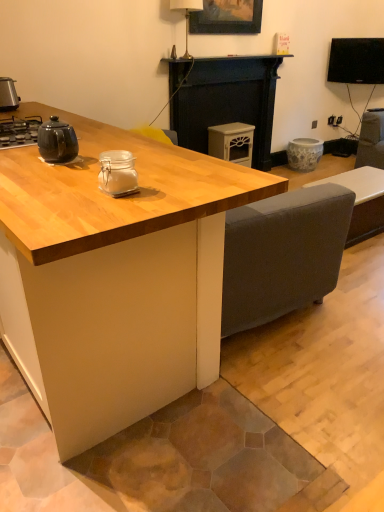
Question: Does porcelain floral pot at center, positioned as the 4th appliance in front-to-back order, have a greater width compared to clear glass jar at center, which appears as the third appliance when viewed from the right?

Choices:
 (A) no
 (B) yes

Answer: (B)

Question: Is porcelain floral pot at center, positioned as the 4th appliance in front-to-back order, oriented away from clear glass jar at center, which is counted as the 4th appliance, starting from the back?

Choices:
 (A) no
 (B) yes

Answer: (A)

Question: Can you confirm if porcelain floral pot at center, arranged as the 1th appliance when viewed from the back, is positioned to the left of clear glass jar at center, which is the first appliance in front-to-back order?

Choices:
 (A) no
 (B) yes

Answer: (A)

Question: From a real-world perspective, is porcelain floral pot at center, which ranks as the 4th appliance in left-to-right order, on clear glass jar at center, which ranks as the 2th appliance in left-to-right order?

Choices:
 (A) no
 (B) yes

Answer: (A)

Question: Does porcelain floral pot at center, positioned as the 4th appliance in front-to-back order, have a lesser height compared to clear glass jar at center, which appears as the third appliance when viewed from the right?

Choices:
 (A) no
 (B) yes

Answer: (A)

Question: From a real-world perspective, relative to light wood table at center, is matte cream cabinet at center, marked as the third appliance in a left-to-right arrangement, vertically above or below?

Choices:
 (A) below
 (B) above

Answer: (A)

Question: Looking at their shapes, would you say matte cream cabinet at center, the 3th appliance from the front, is wider or thinner than light wood table at center?

Choices:
 (A) wide
 (B) thin

Answer: (B)

Question: From the image's perspective, is matte cream cabinet at center, the 2th appliance viewed from the right, above or below light wood table at center?

Choices:
 (A) below
 (B) above

Answer: (B)

Question: Looking at the image, does matte cream cabinet at center, the 3th appliance from the front, seem bigger or smaller compared to light wood table at center?

Choices:
 (A) big
 (B) small

Answer: (B)

Question: Based on their sizes in the image, would you say metallic silver toaster at left, marked as the 3th appliance in a back-to-front arrangement, is bigger or smaller than wooden picture frame at upper center?

Choices:
 (A) big
 (B) small

Answer: (B)

Question: In the image, is metallic silver toaster at left, positioned as the first appliance in left-to-right order, positioned in front of or behind wooden picture frame at upper center?

Choices:
 (A) front
 (B) behind

Answer: (A)

Question: Considering the positions of metallic silver toaster at left, marked as the 3th appliance in a back-to-front arrangement, and wooden picture frame at upper center in the image, is metallic silver toaster at left, marked as the 3th appliance in a back-to-front arrangement, wider or thinner than wooden picture frame at upper center?

Choices:
 (A) wide
 (B) thin

Answer: (A)

Question: Choose the correct answer: Is metallic silver toaster at left, positioned as the first appliance in left-to-right order, inside wooden picture frame at upper center or outside it?

Choices:
 (A) inside
 (B) outside

Answer: (B)

Question: Considering their positions, is black glossy tv at upper right located in front of or behind black matte fireplace at center?

Choices:
 (A) behind
 (B) front

Answer: (A)

Question: Is black glossy tv at upper right taller or shorter than black matte fireplace at center?

Choices:
 (A) short
 (B) tall

Answer: (A)